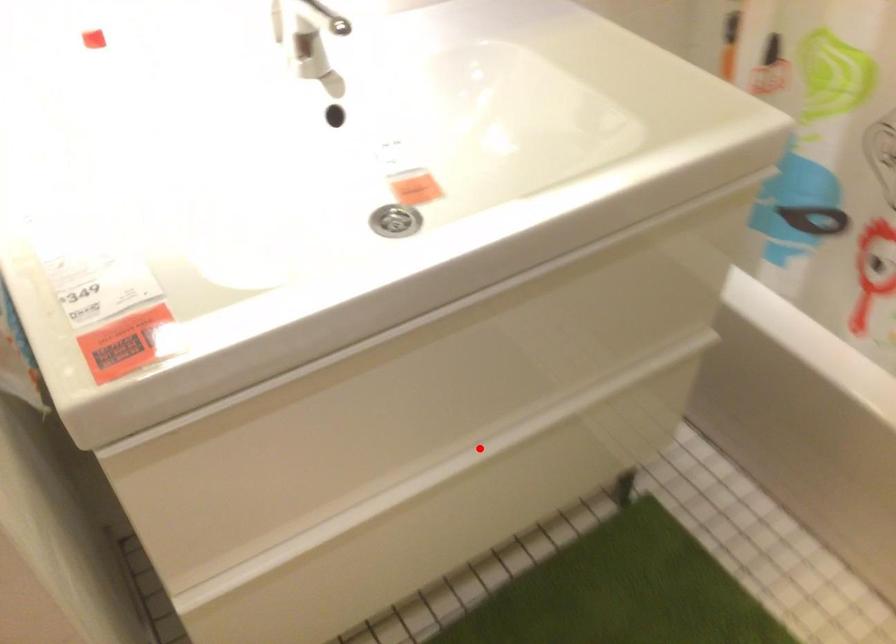
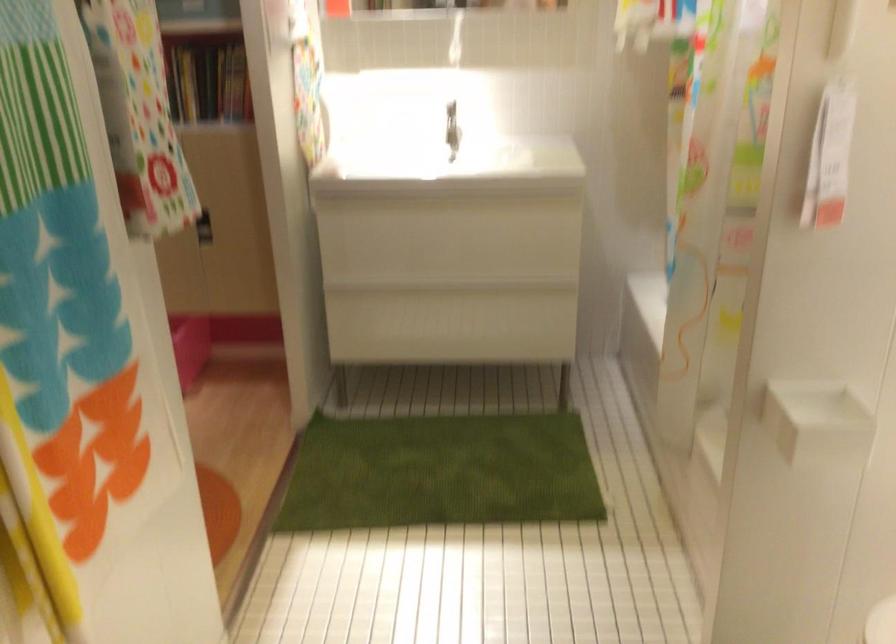
Question: I am providing you with two images of the same scene from different viewpoints. Image1 has a red point marked. In image2, the corresponding 3D location appears at what relative position? Reply with the corresponding letter.

Choices:
 (A) Closer
 (B) Farther

Answer: (B)